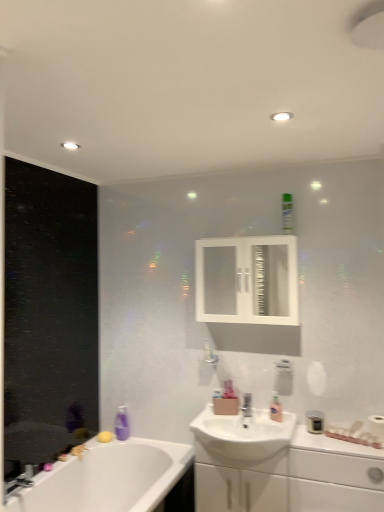
Locate an element on the screen. vacant space positioned to the left of pink glossy lotion at sink, which is the 2th toiletry from top to bottom is located at coordinates (259, 414).